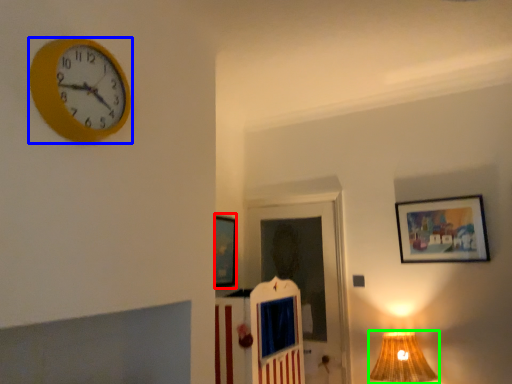
Question: Which object is the farthest from picture frame (highlighted by a red box)? Choose among these: wall clock (highlighted by a blue box) or table lamp (highlighted by a green box).

Choices:
 (A) wall clock
 (B) table lamp

Answer: (A)